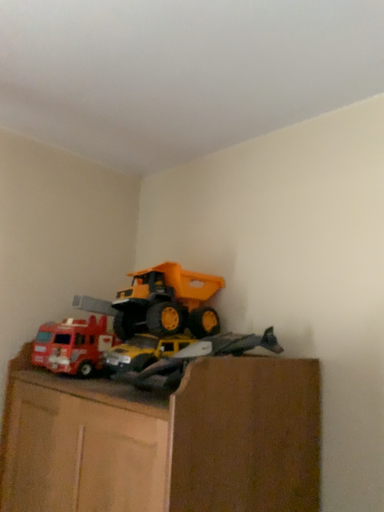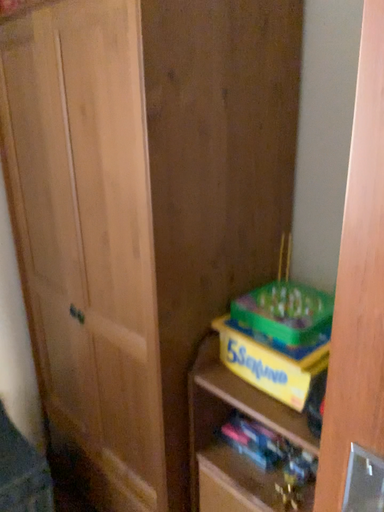
Question: Which way did the camera rotate in the video?

Choices:
 (A) rotated downward
 (B) rotated upward

Answer: (A)